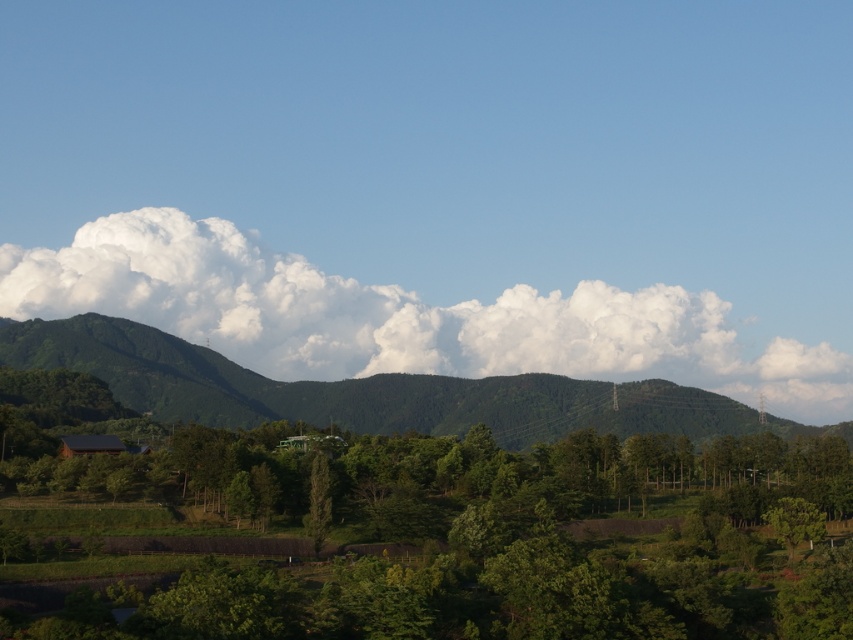
You are standing in the serene landscape described and want to take a photo of the white fluffy cloud at upper center. Considering your camera has a maximum focus range of 1800 feet, will you be able to focus on the cloud?

The white fluffy cloud at upper center is 1843.36 feet away from the viewer, which exceeds the camera maximum focus range of 1800 feet. Therefore, the camera cannot focus on the cloud.

You are an airplane pilot flying over a serene landscape. You notice a white fluffy cloud at upper center and a green textured tree at center. Which object is higher in the sky?

The white fluffy cloud at upper center is higher in the sky than the green textured tree at center.

You are an airplane pilot flying over a landscape. You notice a white fluffy cloud at upper center and a green textured tree at center. Which object is higher in the sky?

The white fluffy cloud at upper center is higher in the sky than the green textured tree at center because it is positioned above it.